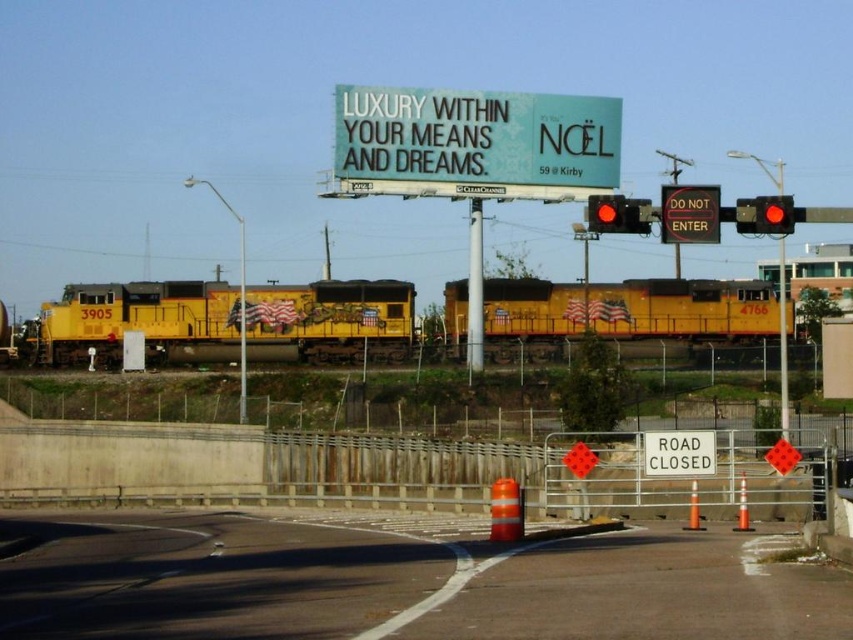
You are standing at the platform waiting for the yellow matte train at center and the yellow matte train car at center to arrive. Which one will you see first as they approach the station?

The yellow matte train at center is taller than the yellow matte train car at center, so you will see the yellow matte train at center first as it approaches the station because its height gives it a visual advantage over the shorter train car.

You are driving a car and need to park near the metallic pole at center. Can you park on the smooth asphalt road at center?

The smooth asphalt road at center has a larger size compared to the metallic pole at center, so yes, you can park on the smooth asphalt road at center near the metallic pole at center since it has enough space.